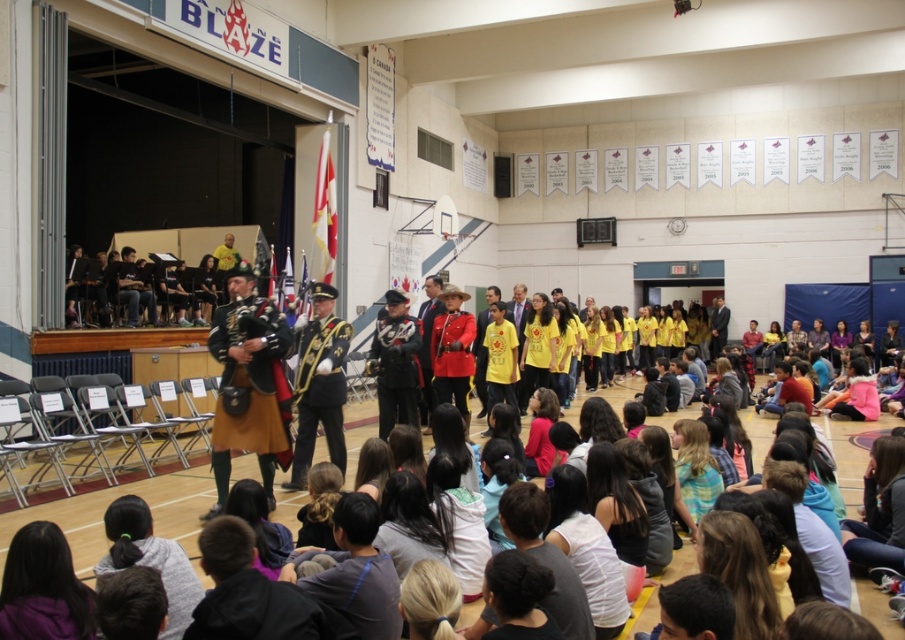
Identify the location of shiny gold uniform at center. Image resolution: width=905 pixels, height=640 pixels. (319, 381).

Is shiny gold uniform at center thinner than dark brown leather jacket at center?

Incorrect, shiny gold uniform at center's width is not less than dark brown leather jacket at center's.

Between point (321, 392) and point (718, 353), which one is positioned in front?

Point (321, 392)

The image size is (905, 640). Find the location of `shiny gold uniform at center`. shiny gold uniform at center is located at coordinates 319,381.

Is red uniform at center bigger than dark brown leather jacket at center?

Incorrect, red uniform at center is not larger than dark brown leather jacket at center.

Who is more forward, (425, 401) or (726, 317)?

Point (425, 401)

The image size is (905, 640). Find the location of `red uniform at center`. red uniform at center is located at coordinates (427, 342).

The width and height of the screenshot is (905, 640). I want to click on red uniform at center, so click(427, 342).

Can you confirm if black fabric at left is shorter than dark brown leather jacket at center?

Yes, black fabric at left is shorter than dark brown leather jacket at center.

This screenshot has height=640, width=905. What do you see at coordinates (134, 289) in the screenshot?
I see `black fabric at left` at bounding box center [134, 289].

Measure the distance between point [153,296] and camera.

They are 14.23 meters apart.

The height and width of the screenshot is (640, 905). I want to click on black fabric at left, so click(x=134, y=289).